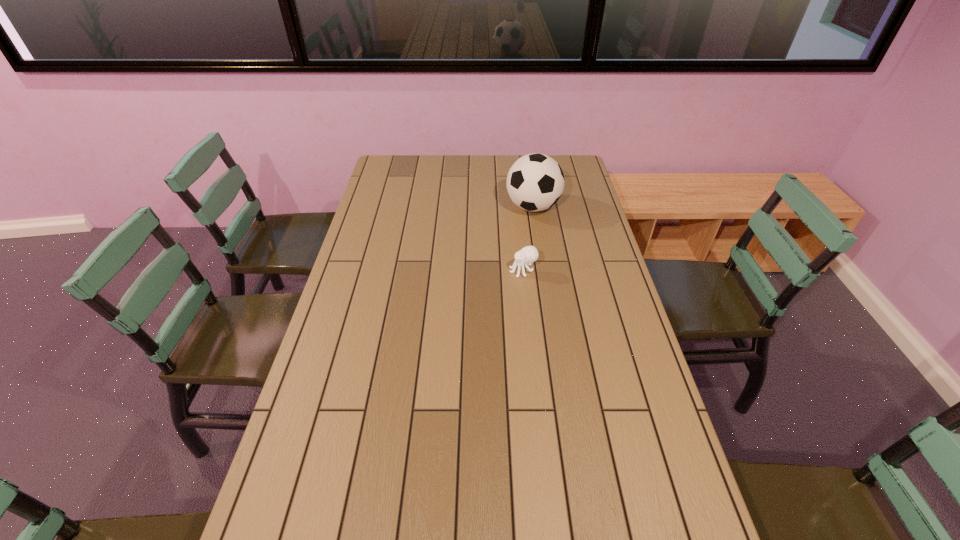
Where is `soccer ball`? The image size is (960, 540). soccer ball is located at coordinates (535, 182).

Find the location of `the taller object`. the taller object is located at coordinates (535, 182).

Image resolution: width=960 pixels, height=540 pixels. I want to click on the shorter object, so click(529, 254).

Find the location of a particular element. the nearer object is located at coordinates (529, 254).

The height and width of the screenshot is (540, 960). What are the coordinates of `vacant space located on the back of the taller object` in the screenshot? It's located at (527, 169).

Find the location of `free point located 0.190m on the front-facing side of the nearer object`. free point located 0.190m on the front-facing side of the nearer object is located at coordinates (453, 271).

Image resolution: width=960 pixels, height=540 pixels. I want to click on free space located 0.190m on the front-facing side of the nearer object, so click(x=453, y=271).

Where is `free space located on the front-facing side of the nearer object`? The width and height of the screenshot is (960, 540). free space located on the front-facing side of the nearer object is located at coordinates click(433, 271).

The image size is (960, 540). I want to click on object at the right edge, so click(535, 182).

The image size is (960, 540). Identify the location of vacant space at the far edge of the desktop. (508, 158).